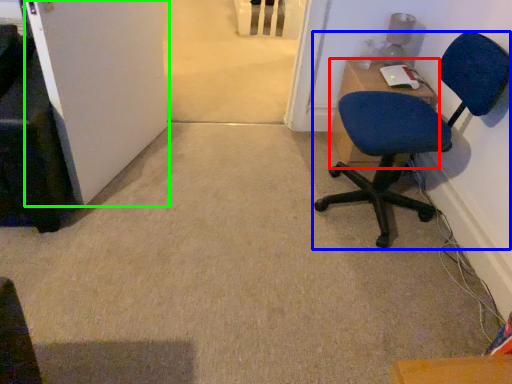
Question: Based on their relative distances, which object is nearer to desk (highlighted by a red box)? Choose from chair (highlighted by a blue box) and door (highlighted by a green box).

Choices:
 (A) chair
 (B) door

Answer: (A)